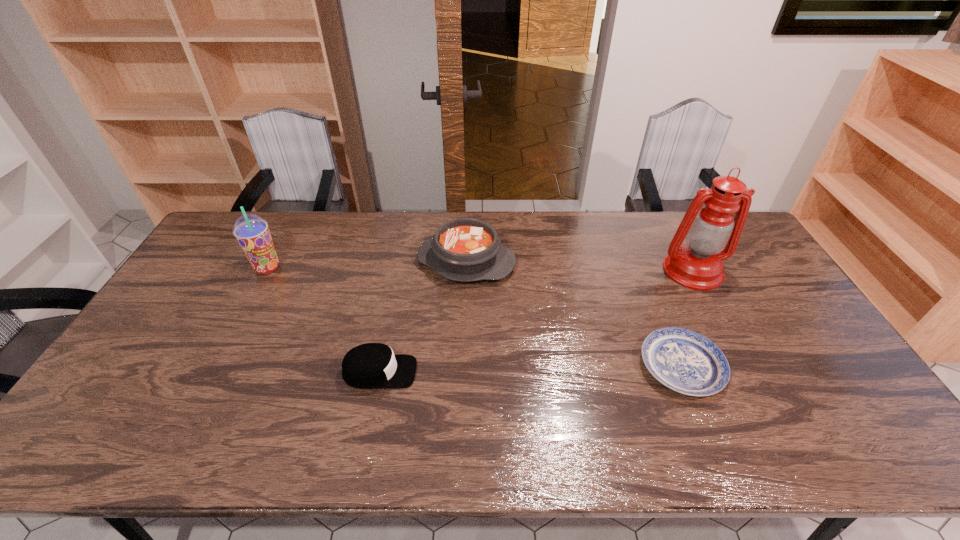
Locate an element on the screen. This screenshot has height=540, width=960. oil lamp is located at coordinates (712, 235).

I want to click on the leftmost object, so click(x=252, y=232).

I want to click on smoothie, so click(252, 232).

Where is `the third tallest object`? This screenshot has height=540, width=960. the third tallest object is located at coordinates (465, 249).

This screenshot has width=960, height=540. In order to click on the fourth tallest object in this screenshot , I will do `click(371, 365)`.

Where is `plate`? The width and height of the screenshot is (960, 540). plate is located at coordinates (685, 361).

The height and width of the screenshot is (540, 960). I want to click on vacant space located on the front of the oil lamp, so click(x=712, y=307).

Locate an element on the screen. vacant area located on the back of the leftmost object is located at coordinates (297, 213).

Locate an element on the screen. blank space located on the front of the third shortest object is located at coordinates (463, 372).

In order to click on free space located 0.360m on the front-facing side of the cap in this screenshot , I will do `click(553, 372)`.